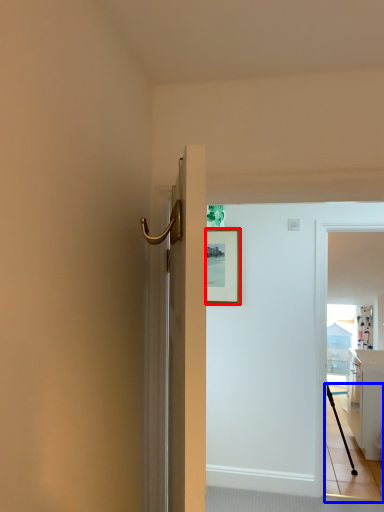
Question: Which object is closer to the camera taking this photo, picture frame (highlighted by a red box) or path (highlighted by a blue box)?

Choices:
 (A) picture frame
 (B) path

Answer: (B)